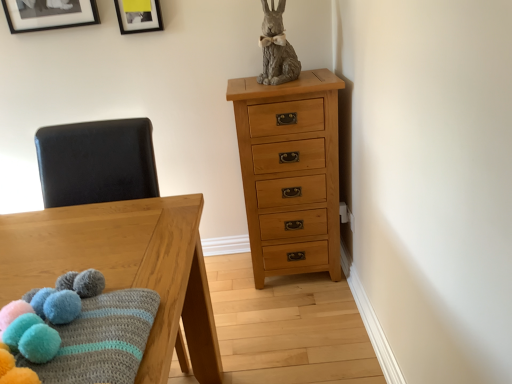
Question: Can you confirm if knitted woolen blanket with pom-poms at lower left is shorter than wooden table at left?

Choices:
 (A) yes
 (B) no

Answer: (A)

Question: Is knitted woolen blanket with pom-poms at lower left at the left side of wooden table at left?

Choices:
 (A) no
 (B) yes

Answer: (A)

Question: From a real-world perspective, is knitted woolen blanket with pom-poms at lower left located higher than wooden table at left?

Choices:
 (A) no
 (B) yes

Answer: (B)

Question: Can you confirm if knitted woolen blanket with pom-poms at lower left is taller than wooden table at left?

Choices:
 (A) yes
 (B) no

Answer: (B)

Question: Is knitted woolen blanket with pom-poms at lower left facing towards wooden table at left?

Choices:
 (A) yes
 (B) no

Answer: (B)

Question: Does knitted woolen blanket with pom-poms at lower left have a larger size compared to wooden table at left?

Choices:
 (A) yes
 (B) no

Answer: (B)

Question: Is light brown wood chest of drawers at upper right further to the viewer compared to black matte picture frame at upper left, placed as the second picture frame when sorted from right to left?

Choices:
 (A) no
 (B) yes

Answer: (A)

Question: From the image's perspective, is light brown wood chest of drawers at upper right under black matte picture frame at upper left, acting as the first picture frame starting from the left?

Choices:
 (A) yes
 (B) no

Answer: (A)

Question: Considering the relative sizes of light brown wood chest of drawers at upper right and black matte picture frame at upper left, placed as the second picture frame when sorted from right to left, in the image provided, is light brown wood chest of drawers at upper right shorter than black matte picture frame at upper left, placed as the second picture frame when sorted from right to left,?

Choices:
 (A) yes
 (B) no

Answer: (B)

Question: Can you confirm if light brown wood chest of drawers at upper right is bigger than black matte picture frame at upper left, acting as the first picture frame starting from the left?

Choices:
 (A) yes
 (B) no

Answer: (A)

Question: From the image's perspective, is light brown wood chest of drawers at upper right on top of black matte picture frame at upper left, acting as the first picture frame starting from the left?

Choices:
 (A) no
 (B) yes

Answer: (A)

Question: Does light brown wood chest of drawers at upper right have a smaller size compared to black matte picture frame at upper left, placed as the second picture frame when sorted from right to left?

Choices:
 (A) no
 (B) yes

Answer: (A)

Question: Does black matte picture frame at upper left, acting as the first picture frame starting from the left, have a smaller size compared to wooden table at left?

Choices:
 (A) no
 (B) yes

Answer: (B)